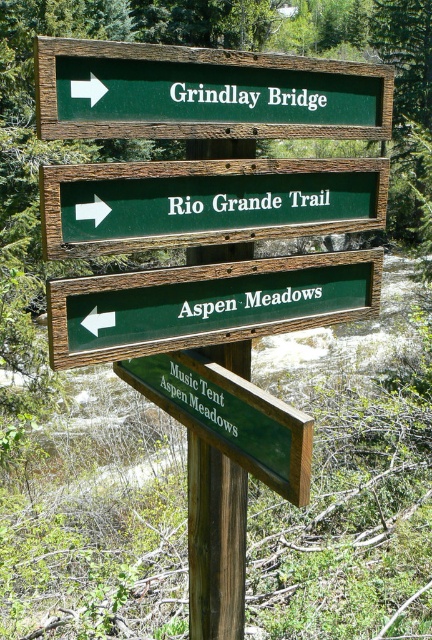
You are a hiker at the signpost and need to decide your path. The green wooden sign at upper center points to Grindlay Bridge, and the green wooden sign at lower right points to Aspen Meadows. Which direction should you go if you want to follow the path that is above the other sign?

You should go to Grindlay Bridge because the green wooden sign at upper center, which points to Grindlay Bridge, is positioned over the green wooden sign at lower right pointing to Aspen Meadows. This means the path to Grindlay Bridge is above the path to Aspen Meadows.

You are standing at the forest trail and see the green wooden sign at center and the brown wooden signpost at center. Which one is higher up?

The green wooden sign at center is located above the brown wooden signpost at center, so it is higher up.

You are standing at the wooden signpost in the forest and want to head towards Grindlay Bridge. Which direction should you go based on the green wooden sign at center and the brown wooden signpost at center?

The green wooden sign at center is to the right of the brown wooden signpost at center, so you should head to the right to reach Grindlay Bridge.